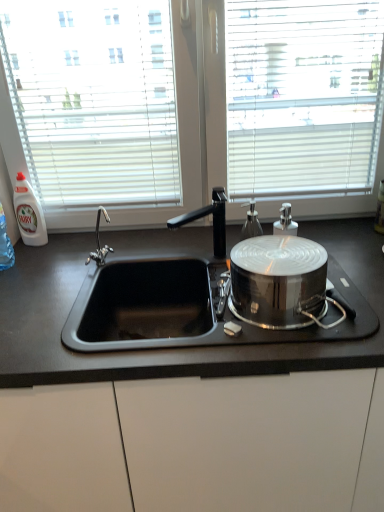
The height and width of the screenshot is (512, 384). Identify the location of free spot to the right of polished stainless steel pot at right. (350, 303).